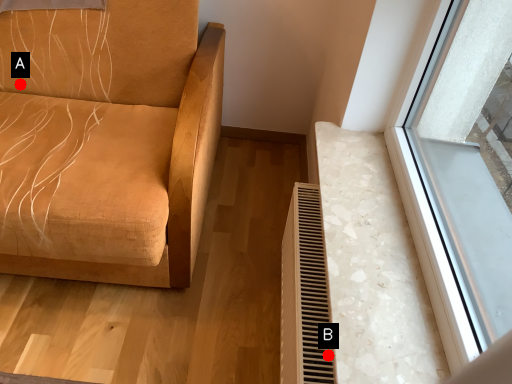
Question: Two points are circled on the image, labeled by A and B beside each circle. Which point is farther to the camera?

Choices:
 (A) A is further
 (B) B is further

Answer: (A)